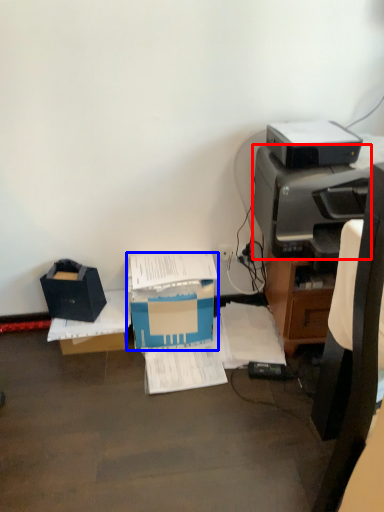
Question: Which object appears farthest to the camera in this image, printer (highlighted by a red box) or box (highlighted by a blue box)?

Choices:
 (A) printer
 (B) box

Answer: (B)